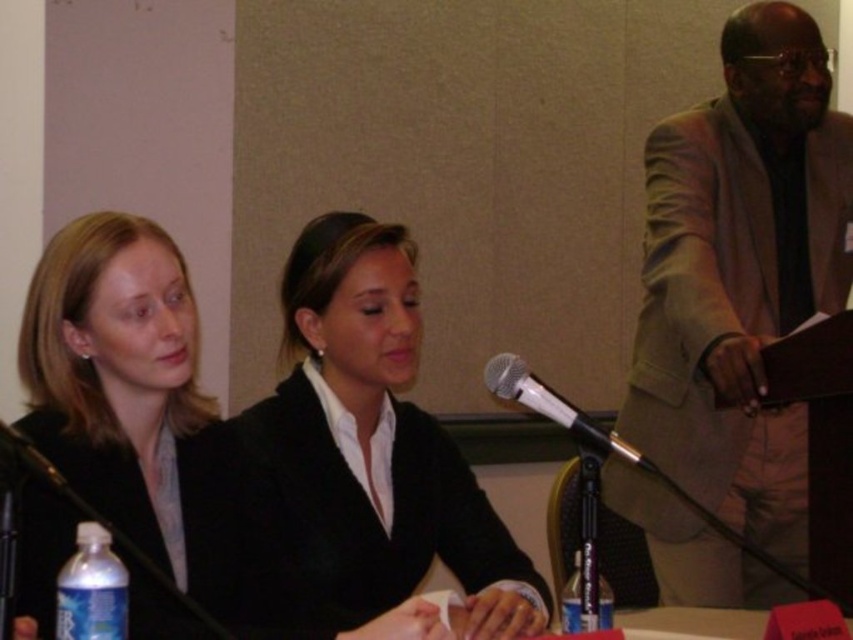
From the picture: You are attending a formal event and need to place a decorative item on the table. The black matte blazer at center and the clear plastic bottle at lower center are already present. Which object should you avoid placing something on top of if you want it to be visible?

The clear plastic bottle at lower center is shorter than the black matte blazer at center. Since the clear plastic bottle is shorter, placing an item on top of it may make it less visible compared to placing it on the taller black matte blazer at center.

You are organizing a panel discussion and need to place a name tag on the clear plastic bottle at lower left and the black matte business suit at left. Which object requires a larger name tag based on their sizes?

The black matte business suit at left requires a larger name tag because it is taller than the clear plastic bottle at lower left.

You are organizing a conference and need to place a name tag for the speaker who is wearing the black matte business suit at left. Where should you place the name tag relative to the clear plastic bottle at lower left?

The clear plastic bottle at lower left is to the left of the black matte business suit at left, so the name tag should be placed to the right of the clear plastic bottle at lower left to reach the black matte business suit at left.